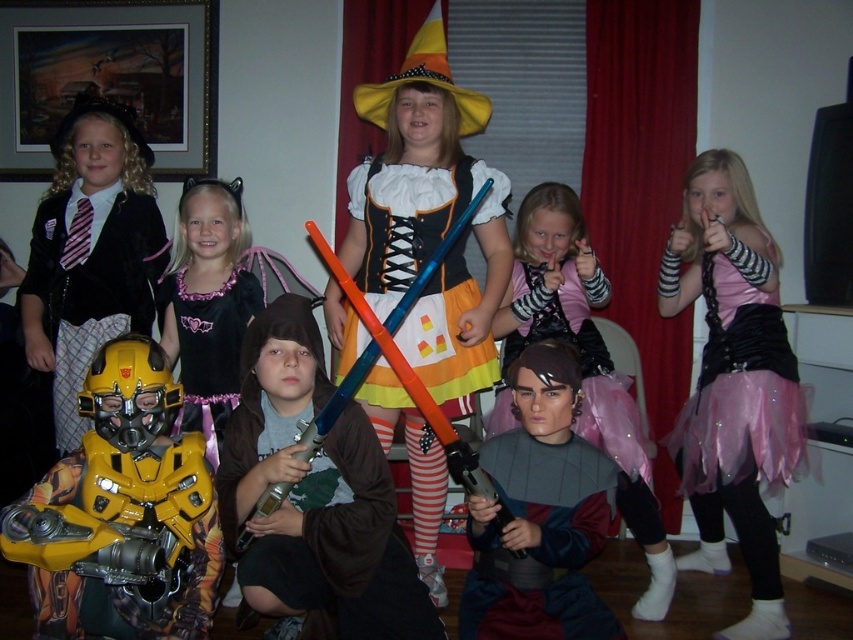
You are a photographer setting up for a group photo of the children. You want to ensure that both the orange and yellow striped stockings at center and the pink satin tutu at center are clearly visible. Which costume should you focus on first to ensure proper lighting, considering their sizes?

The orange and yellow striped stockings at center should be focused on first because it has a larger size compared to the pink satin tutu at center, so ensuring proper lighting on it first will help balance the exposure for both.

You are a photographer setting up for a group photo of the children in the scene. You need to ensure that both the orange and yellow striped stockings at center and the pink satin tutu at center are fully visible in the photo. Given their heights, which costume should be placed in the back row to avoid blocking the other?

The orange and yellow striped stockings at center is much taller than the pink satin tutu at center, so to ensure both are fully visible, the orange and yellow striped stockings at center should be placed in the back row so they don,t block the pink satin tutu at center.

You are a photographer setting up for a group photo. You need to ensure that the orange and yellow striped stockings at center and the velvet black dress at upper left are both visible in the frame. Given that the stockings are wider than the dress, which object should you position closer to the center of the frame to maintain balance?

Since the orange and yellow striped stockings at center are wider than the velvet black dress at upper left, positioning the stockings closer to the center of the frame will help balance their visual weight in the composition.